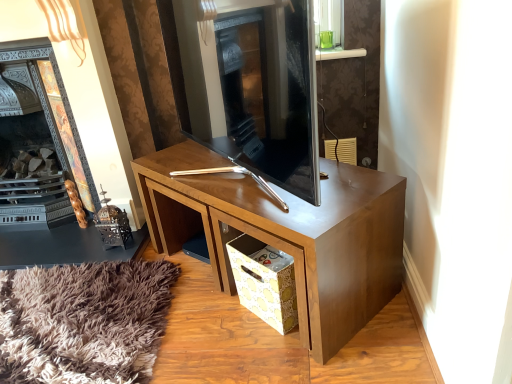
The width and height of the screenshot is (512, 384). Find the location of `vacant area that is in front of yellow paper bag at lower center`. vacant area that is in front of yellow paper bag at lower center is located at coordinates (273, 359).